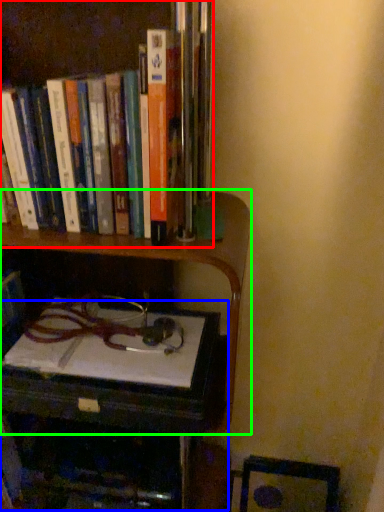
Question: Considering the real-world distances, which object is farthest from book (highlighted by a red box)? table (highlighted by a blue box) or shelf (highlighted by a green box)?

Choices:
 (A) table
 (B) shelf

Answer: (A)